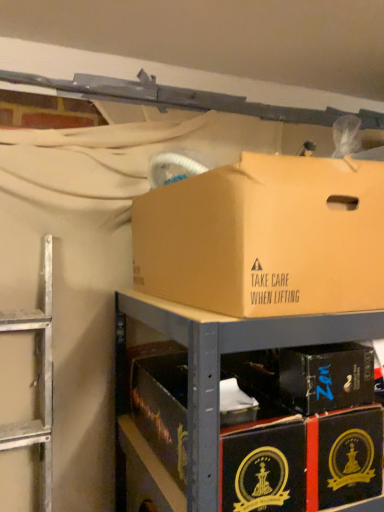
Question: From the image's perspective, would you say brown cardboard box at upper center, which is the second box from bottom to top, is positioned over black cardboard boxes at lower right?

Choices:
 (A) no
 (B) yes

Answer: (B)

Question: Is brown cardboard box at upper center, which is the second box from bottom to top, to the left of black cardboard boxes at lower right from the viewer's perspective?

Choices:
 (A) yes
 (B) no

Answer: (A)

Question: Can you confirm if brown cardboard box at upper center, which is the second box from bottom to top, is positioned to the right of black cardboard boxes at lower right?

Choices:
 (A) no
 (B) yes

Answer: (A)

Question: Can you confirm if brown cardboard box at upper center, marked as the 1th box in a top-to-bottom arrangement, is taller than black cardboard boxes at lower right?

Choices:
 (A) yes
 (B) no

Answer: (A)

Question: Is brown cardboard box at upper center, marked as the 1th box in a top-to-bottom arrangement, smaller than black cardboard boxes at lower right?

Choices:
 (A) no
 (B) yes

Answer: (A)

Question: Considering the positions of black cardboard boxes at lower right and brown cardboard box at upper center, marked as the 1th box in a top-to-bottom arrangement, in the image, is black cardboard boxes at lower right wider or thinner than brown cardboard box at upper center, marked as the 1th box in a top-to-bottom arrangement,?

Choices:
 (A) wide
 (B) thin

Answer: (A)

Question: Is black cardboard boxes at lower right inside or outside of brown cardboard box at upper center, marked as the 1th box in a top-to-bottom arrangement?

Choices:
 (A) outside
 (B) inside

Answer: (A)

Question: Based on their positions, is black cardboard boxes at lower right located to the left or right of brown cardboard box at upper center, marked as the 1th box in a top-to-bottom arrangement?

Choices:
 (A) right
 (B) left

Answer: (A)

Question: Is black cardboard boxes at lower right bigger or smaller than brown cardboard box at upper center, marked as the 1th box in a top-to-bottom arrangement?

Choices:
 (A) big
 (B) small

Answer: (B)

Question: Is point (349, 359) positioned closer to the camera than point (119, 336)?

Choices:
 (A) closer
 (B) farther

Answer: (A)

Question: From the image's perspective, relative to black cardboard boxes at lower right, is black cardboard box at center, which is the 1th box from bottom to top, above or below?

Choices:
 (A) below
 (B) above

Answer: (B)

Question: Considering the positions of black cardboard box at center, which is the 1th box from bottom to top, and black cardboard boxes at lower right in the image, is black cardboard box at center, which is the 1th box from bottom to top, wider or thinner than black cardboard boxes at lower right?

Choices:
 (A) wide
 (B) thin

Answer: (B)

Question: Considering their positions, is black cardboard box at center, which is the 1th box from bottom to top, located in front of or behind black cardboard boxes at lower right?

Choices:
 (A) front
 (B) behind

Answer: (B)

Question: Looking at their shapes, would you say brown cardboard box at upper center, which is the second box from bottom to top, is wider or thinner than black cardboard box at center, which is the 1th box from bottom to top?

Choices:
 (A) wide
 (B) thin

Answer: (A)

Question: In the image, is brown cardboard box at upper center, which is the second box from bottom to top, positioned in front of or behind black cardboard box at center, which is the 1th box from bottom to top?

Choices:
 (A) behind
 (B) front

Answer: (B)